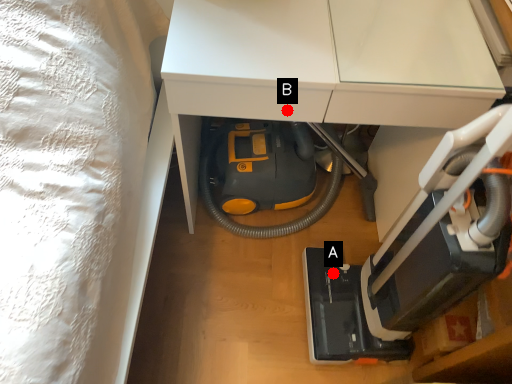
Question: Two points are circled on the image, labeled by A and B beside each circle. Which point appears farthest from the camera in this image?

Choices:
 (A) A is further
 (B) B is further

Answer: (A)